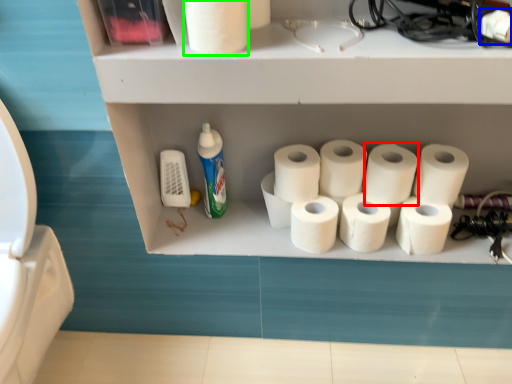
Question: Which object is the closest to the toilet paper (highlighted by a red box)? Choose among these: toilet paper (highlighted by a blue box) or toilet paper (highlighted by a green box).

Choices:
 (A) toilet paper
 (B) toilet paper

Answer: (A)